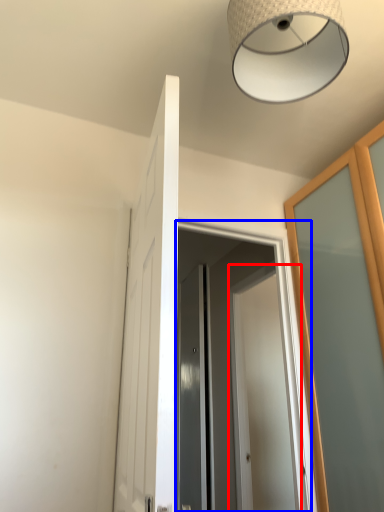
Question: Which object is closer to the camera taking this photo, door (highlighted by a red box) or screen door (highlighted by a blue box)?

Choices:
 (A) door
 (B) screen door

Answer: (B)